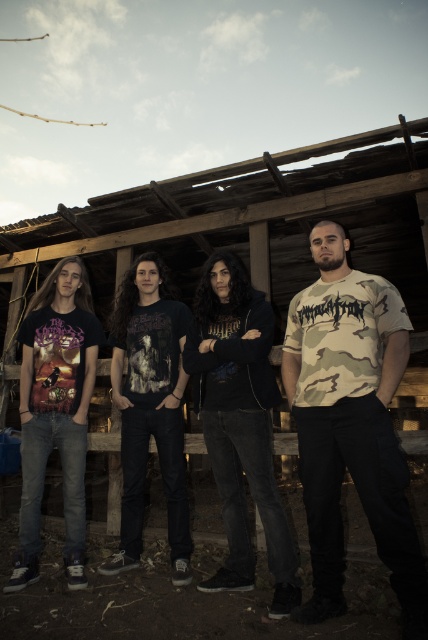
Question: Can you confirm if camo fabric t-shirt at right is bigger than black matte hoodie at center?

Choices:
 (A) no
 (B) yes

Answer: (A)

Question: Is camo fabric t-shirt at right further to the viewer compared to black matte hoodie at center?

Choices:
 (A) no
 (B) yes

Answer: (A)

Question: Observing the image, what is the correct spatial positioning of camo fabric t-shirt at right in reference to black matte hoodie at center?

Choices:
 (A) above
 (B) below

Answer: (A)